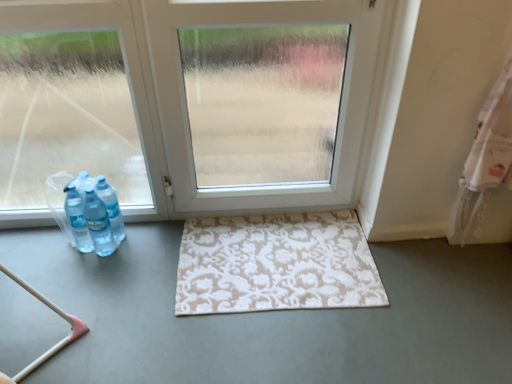
Question: In terms of size, does white matte door at center appear bigger or smaller than white matte rug at center?

Choices:
 (A) small
 (B) big

Answer: (A)

Question: In terms of height, does white matte door at center look taller or shorter compared to white matte rug at center?

Choices:
 (A) tall
 (B) short

Answer: (A)

Question: Considering the real-world distances, which object is closest to the white matte door at center?

Choices:
 (A) translucent plastic bottles at left
 (B) white matte rug at center
 (C) beige patterned rug at center

Answer: (C)

Question: Which object is positioned farthest from the white matte door at center?

Choices:
 (A) beige patterned rug at center
 (B) translucent plastic bottles at left
 (C) white matte rug at center

Answer: (C)